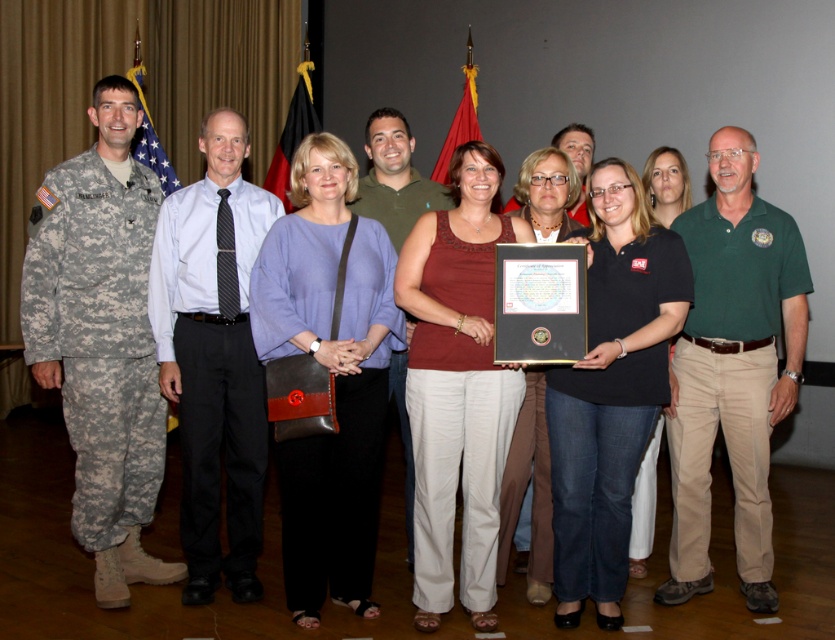
You are a photographer adjusting the camera settings for the group photo. The camera has a focus area that can only accommodate objects of a certain width. You need to ensure both the matte purple blouse at center and the matte black frame at center are in focus. Based on their widths, will the focus area be sufficient to capture both?

The matte purple blouse at center might be wider than matte black frame at center, so the focus area needs to be at least as wide as the blouse to ensure both are in focus.

You are standing in front of the group photo and want to locate the matte purple blouse at center. According to the coordinates provided, where would you look to find it?

Result: The matte purple blouse at center is located at the 2D coordinates point [331,372].

You are a photographer who needs to adjust the lighting for the group photo. You notice two people at the center of the image wearing the green cotton shirt at center and the black shirt at center. Which one is positioned to the left of the other?

The green cotton shirt at center is to the left of the black shirt at center.